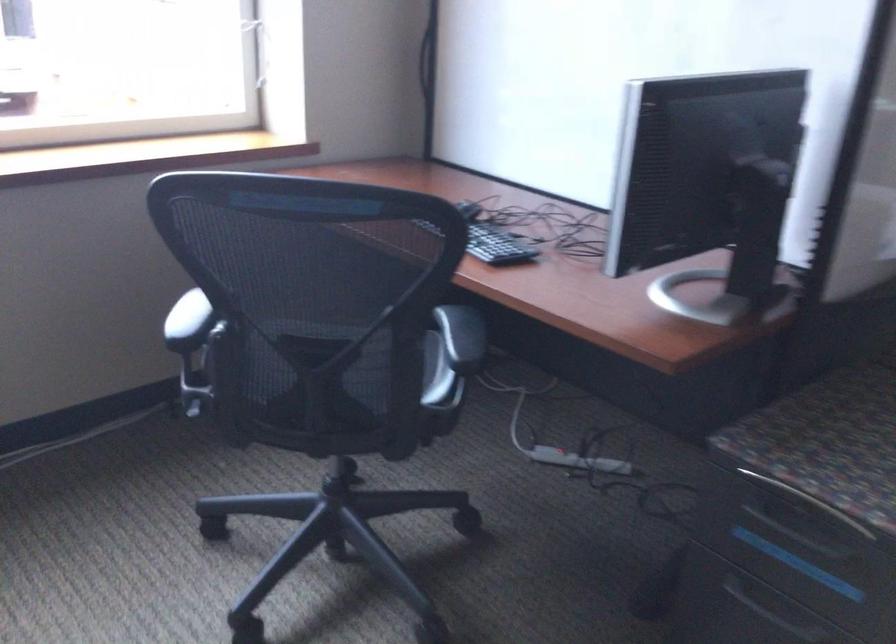
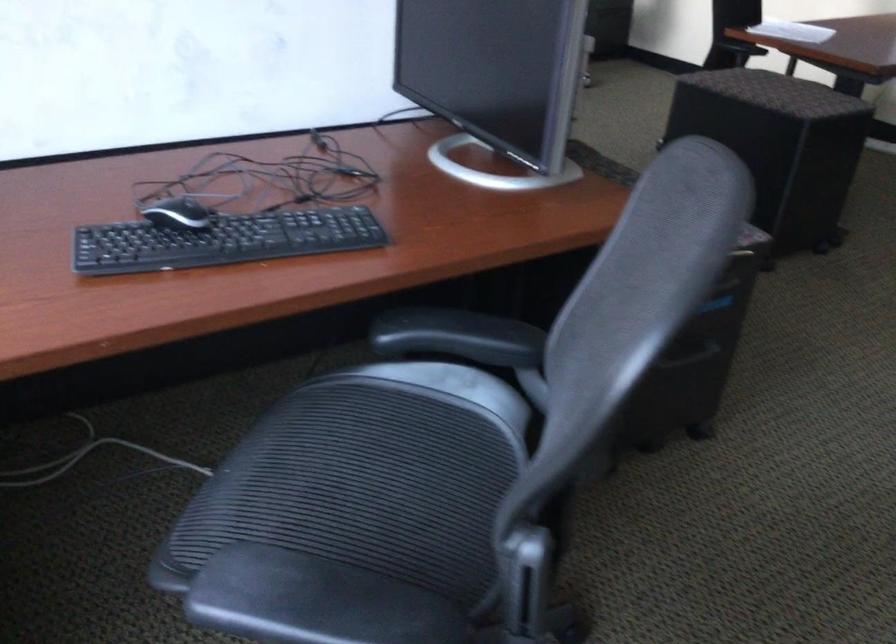
Question: I am providing you with two images of the same scene from different viewpoints. Please identify which objects are invisible in image2.

Choices:
 (A) purple stuffed toy
 (B) power strip switch
 (C) black chair armrest
 (D) black storage ottoman

Answer: (B)